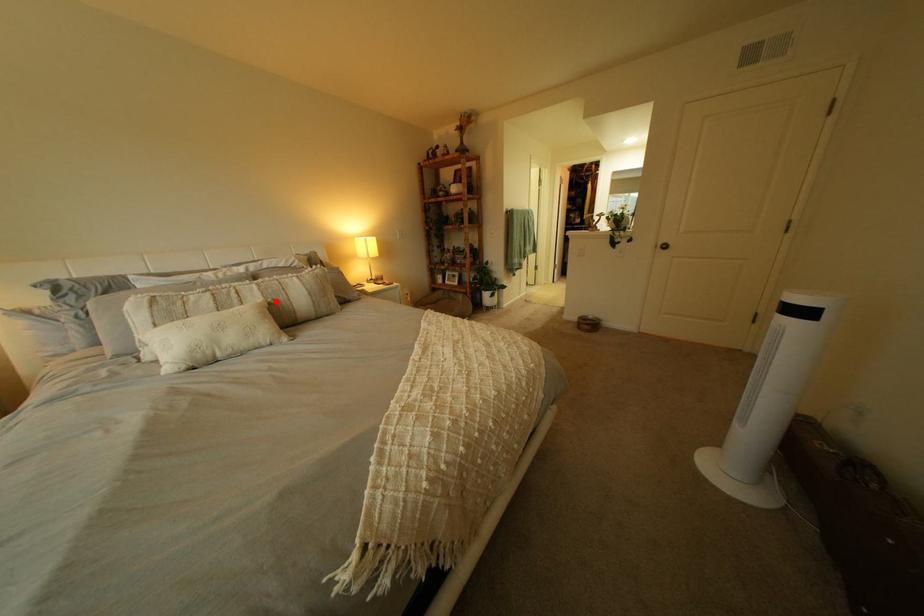
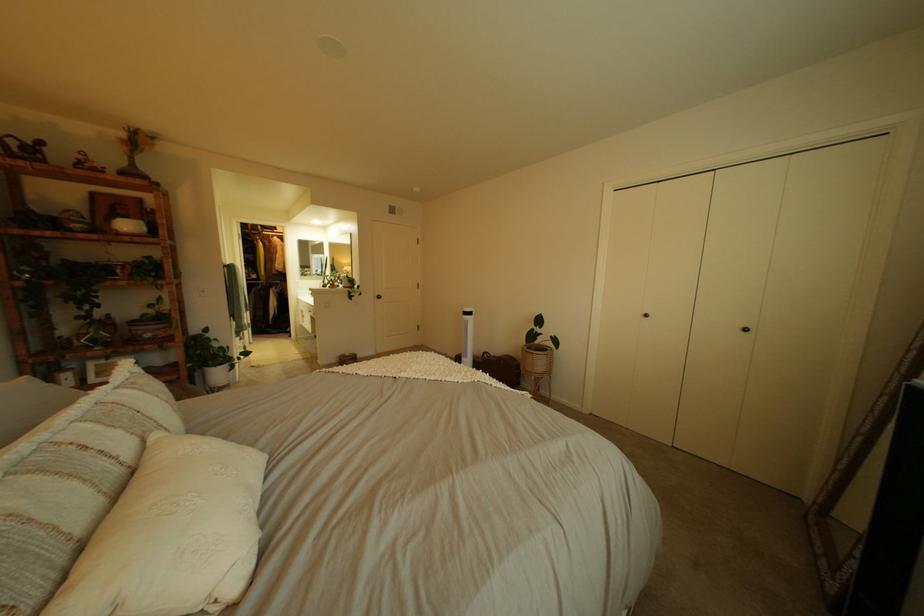
In the second image, find the point that corresponds to the highlighted location in the first image.

(172, 436)